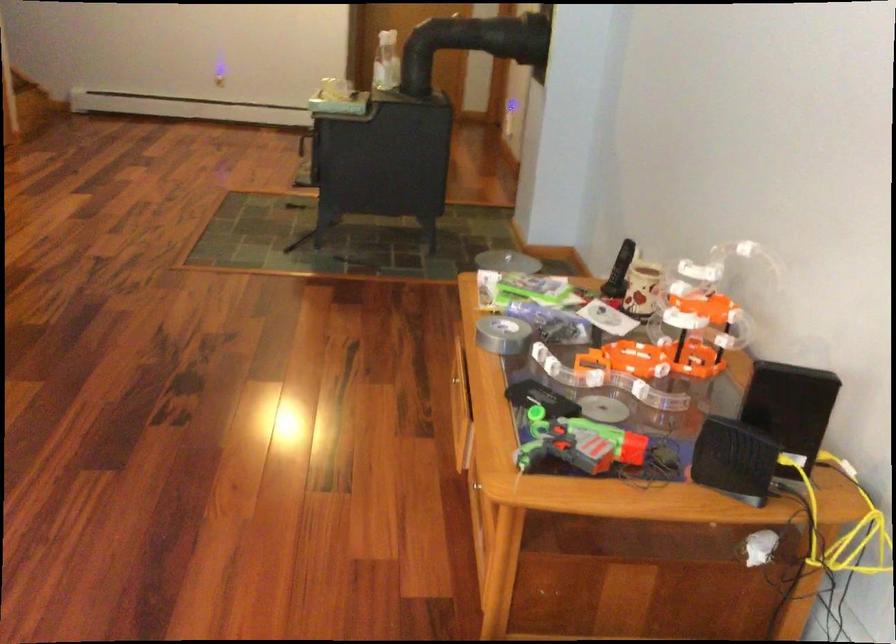
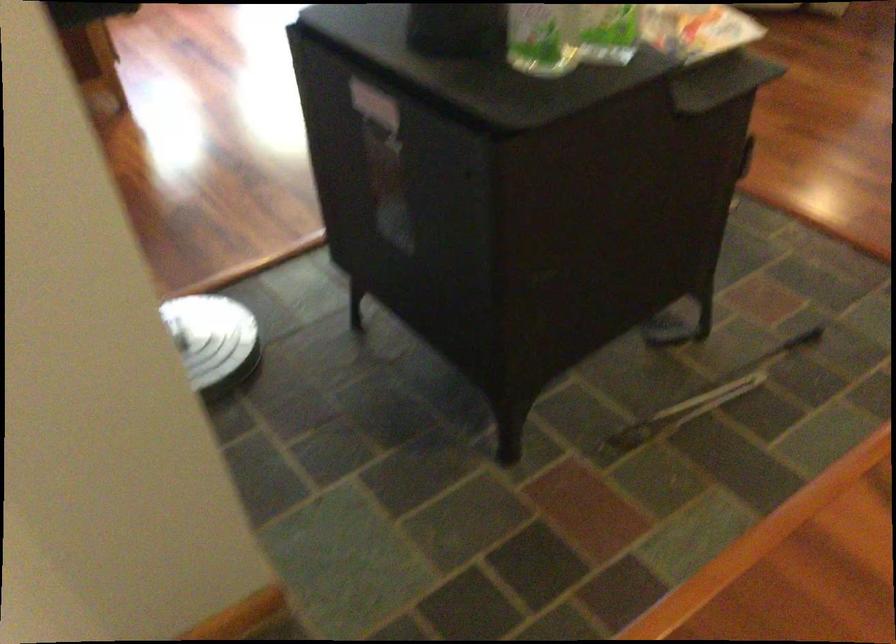
Where in the second image is the point corresponding to point (412, 82) from the first image?

(541, 38)